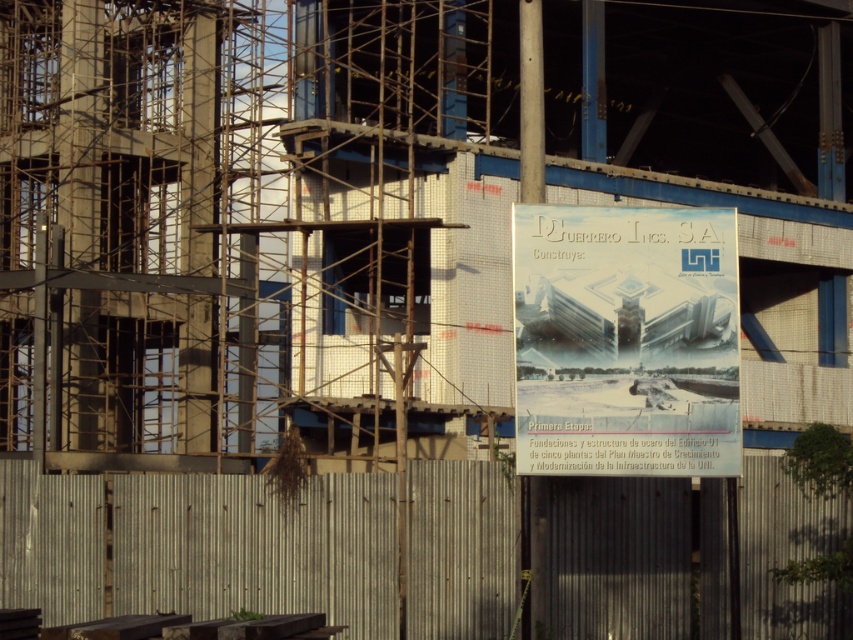
Question: Which of the following is the closest to the observer?

Choices:
 (A) white paper poster at center
 (B) metallic corrugated fence at lower center

Answer: (A)

Question: Can you confirm if metallic corrugated fence at lower center is smaller than white paper poster at center?

Choices:
 (A) yes
 (B) no

Answer: (B)

Question: Is metallic corrugated fence at lower center bigger than white paper poster at center?

Choices:
 (A) yes
 (B) no

Answer: (A)

Question: Which of the following is the closest to the observer?

Choices:
 (A) metallic corrugated fence at lower center
 (B) white paper poster at center

Answer: (B)

Question: Does metallic corrugated fence at lower center have a larger size compared to white paper poster at center?

Choices:
 (A) yes
 (B) no

Answer: (A)